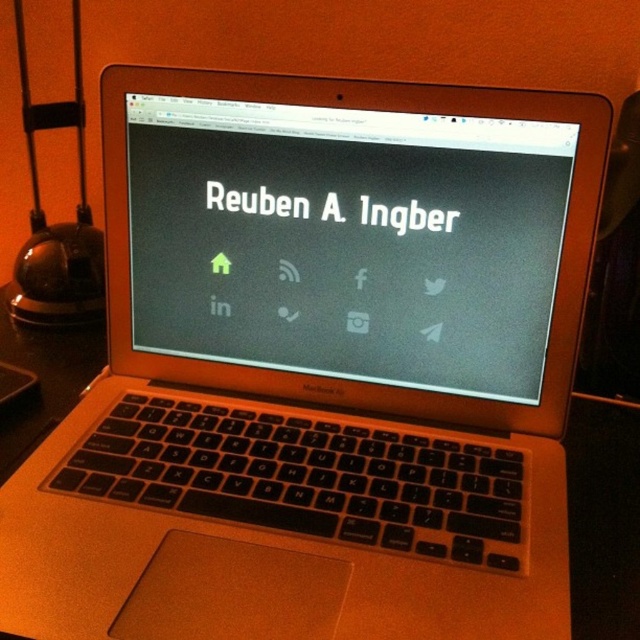
You are a graphic designer working on a project and need to place a new icon exactly at the center of the black matte screen at center. Given that the screen is positioned at point (348, 241), can you confirm if this coordinate is indeed the center of the screen?

The black matte screen at center is located at point (348, 241), so yes, this coordinate is the center of the screen.

You are setting up a desk for a night work session. You have a black matte screen at center and a metallic glass table lamp at left. Considering their sizes, which object should you adjust to avoid casting a shadow on your work area?

The metallic glass table lamp at left is larger than the black matte screen at center, so adjusting the position of the metallic glass table lamp at left would help prevent its shadow from falling on your work area.